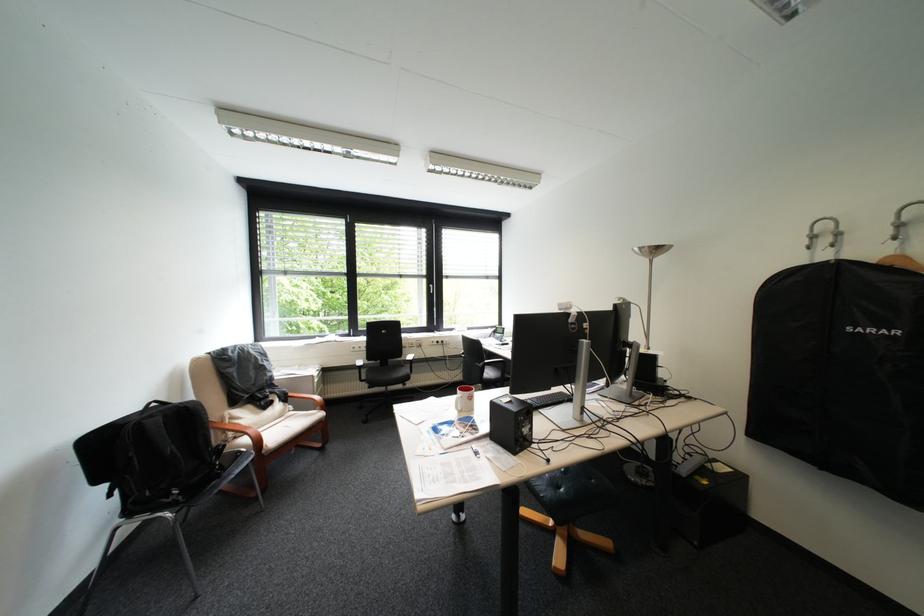
Where would you hang the wooden clothes hanger? Please return your answer as a coordinate pair (x, y).

(897, 262)